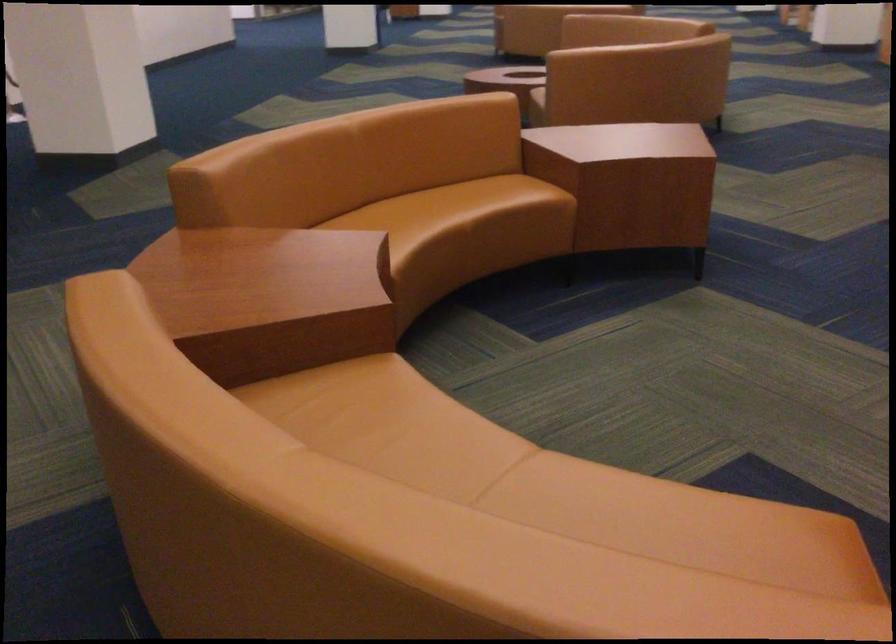
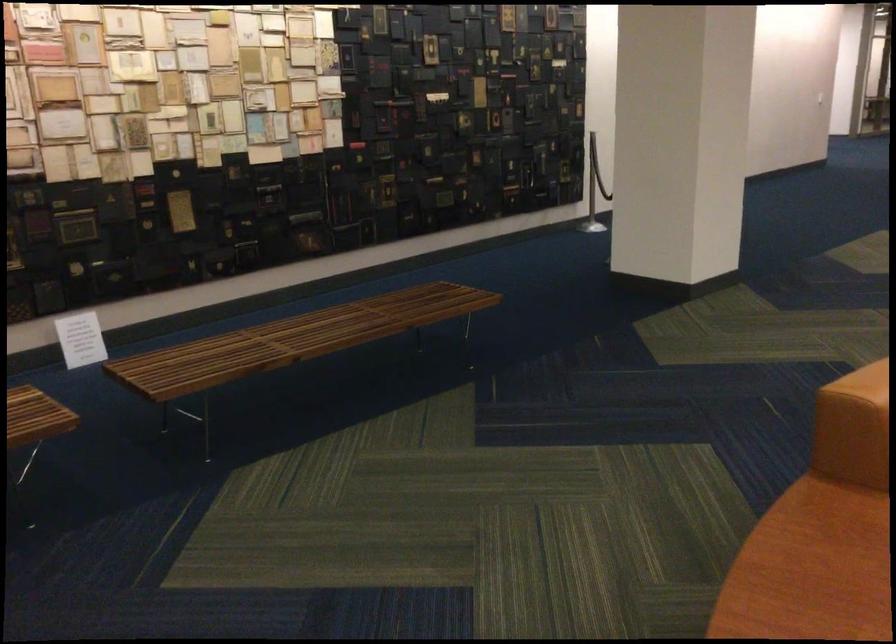
In the second image, find the point that corresponds to point (177, 276) in the first image.

(811, 569)